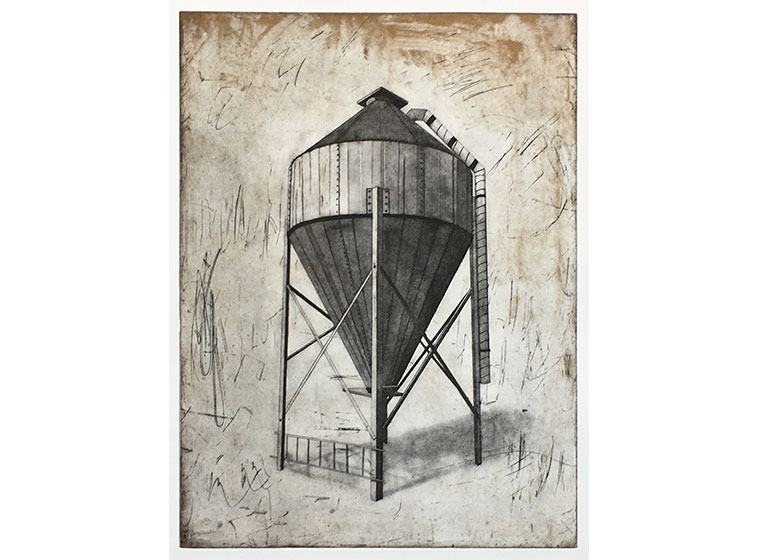
Locate an element on the screen. The height and width of the screenshot is (560, 760). picture is located at coordinates (248, 133).